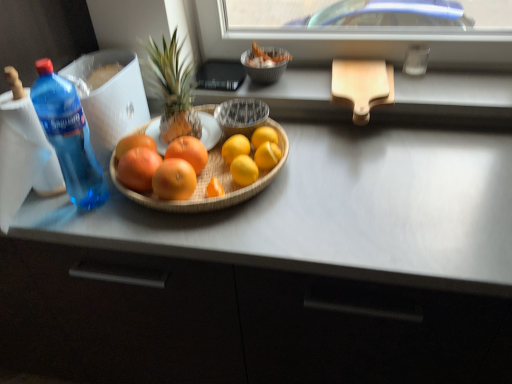
I want to click on space that is in front of metallic silver bowl at upper center, so click(x=275, y=97).